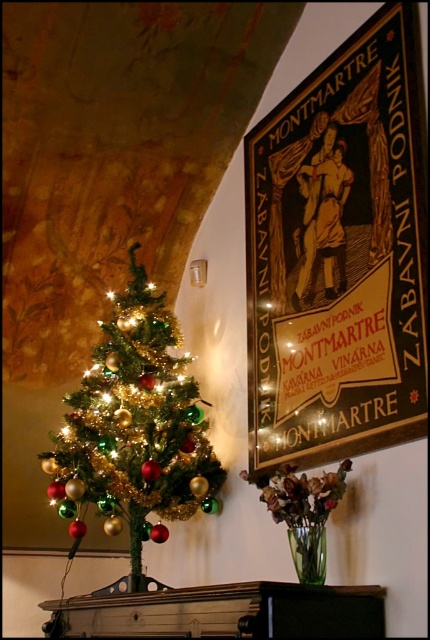
Is black glossy signboard at upper right positioned in front of shiny metallic christmas tree at left?

Yes.

Does black glossy signboard at upper right have a greater width compared to shiny metallic christmas tree at left?

No, black glossy signboard at upper right is not wider than shiny metallic christmas tree at left.

In order to click on black glossy signboard at upper right in this screenshot , I will do `click(340, 253)`.